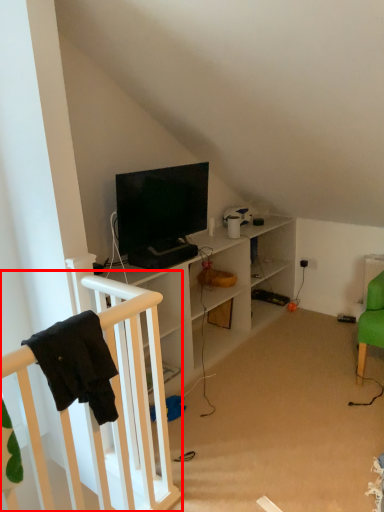
Question: Where is infant bed (annotated by the red box) located in relation to television in the image?

Choices:
 (A) left
 (B) right

Answer: (A)